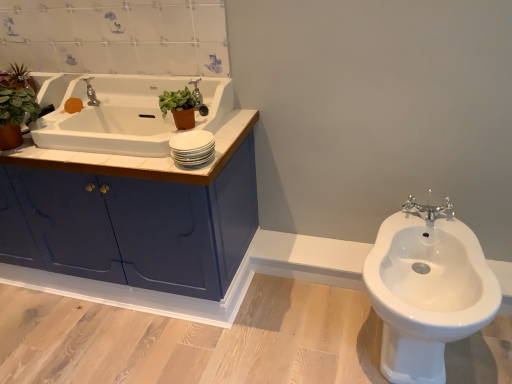
Question: Does chrome metallic tap at right, which is the second tap from left to right, have a lesser height compared to orange matte soap at upper left?

Choices:
 (A) no
 (B) yes

Answer: (A)

Question: Does chrome metallic tap at right, positioned as the 2th tap in top-to-bottom order, lie behind orange matte soap at upper left?

Choices:
 (A) no
 (B) yes

Answer: (A)

Question: Considering the relative sizes of chrome metallic tap at right, the 2th tap positioned from the back, and orange matte soap at upper left in the image provided, is chrome metallic tap at right, the 2th tap positioned from the back, smaller than orange matte soap at upper left?

Choices:
 (A) yes
 (B) no

Answer: (B)

Question: Can we say chrome metallic tap at right, which is the first tap in bottom-to-top order, lies outside orange matte soap at upper left?

Choices:
 (A) yes
 (B) no

Answer: (A)

Question: Is orange matte soap at upper left at the back of chrome metallic tap at right, the 1th tap positioned from the right?

Choices:
 (A) no
 (B) yes

Answer: (A)

Question: Is chrome metallic tap at right, the 1th tap positioned from the right, to the left of orange matte soap at upper left from the viewer's perspective?

Choices:
 (A) no
 (B) yes

Answer: (A)

Question: Can you confirm if blue glossy cabinet at left is positioned to the left of white wood counter top at upper left?

Choices:
 (A) no
 (B) yes

Answer: (B)

Question: Is blue glossy cabinet at left turned away from white wood counter top at upper left?

Choices:
 (A) yes
 (B) no

Answer: (B)

Question: From a real-world perspective, is blue glossy cabinet at left physically below white wood counter top at upper left?

Choices:
 (A) yes
 (B) no

Answer: (A)

Question: Can you see blue glossy cabinet at left touching white wood counter top at upper left?

Choices:
 (A) yes
 (B) no

Answer: (B)

Question: From the image's perspective, is blue glossy cabinet at left on top of white wood counter top at upper left?

Choices:
 (A) yes
 (B) no

Answer: (B)

Question: From a real-world perspective, is blue glossy cabinet at left positioned over white wood counter top at upper left based on gravity?

Choices:
 (A) yes
 (B) no

Answer: (B)

Question: Can you confirm if chrome metallic tap at right, the 1th tap positioned from the right, is shorter than white wood counter top at upper left?

Choices:
 (A) no
 (B) yes

Answer: (B)